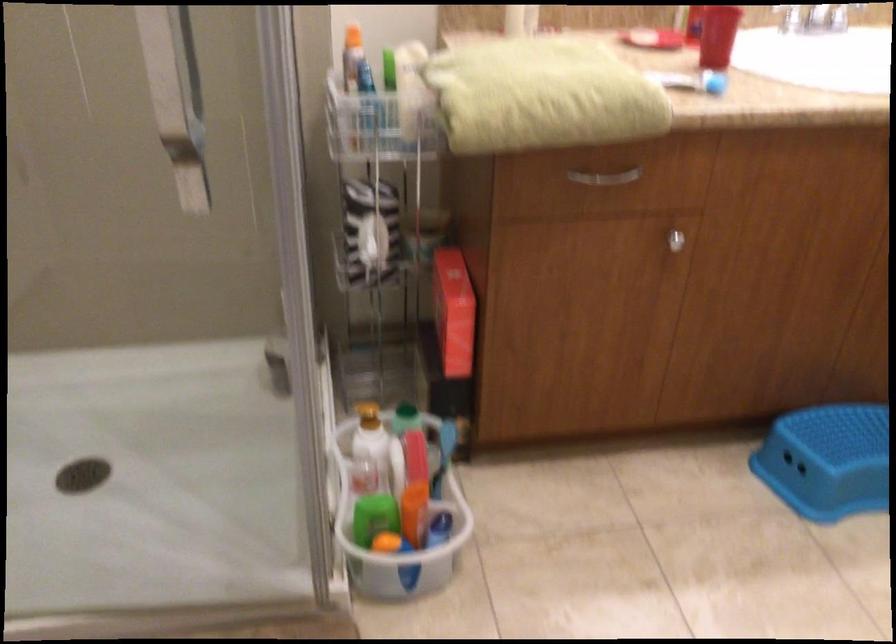
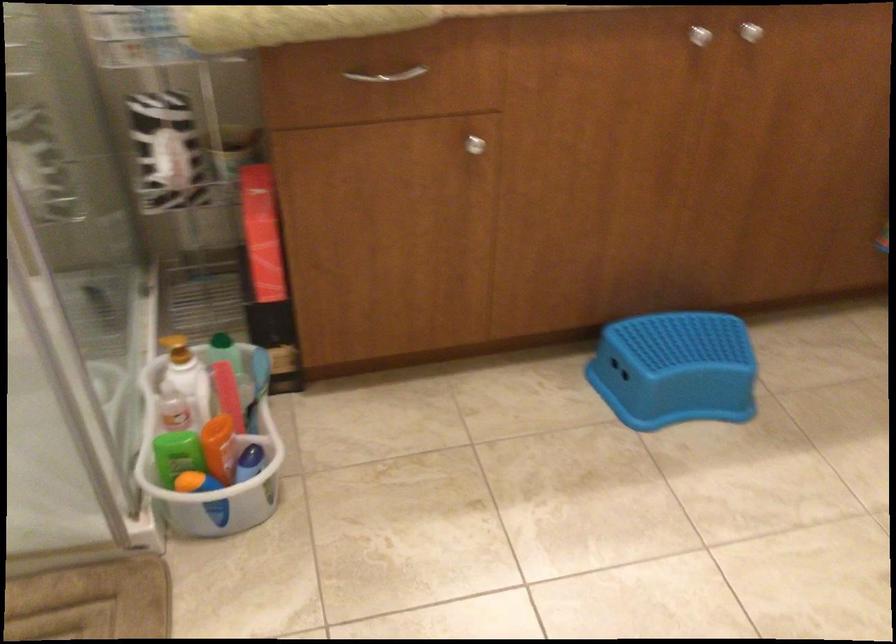
In the second image, find the point that corresponds to [446,520] in the first image.

(255, 451)